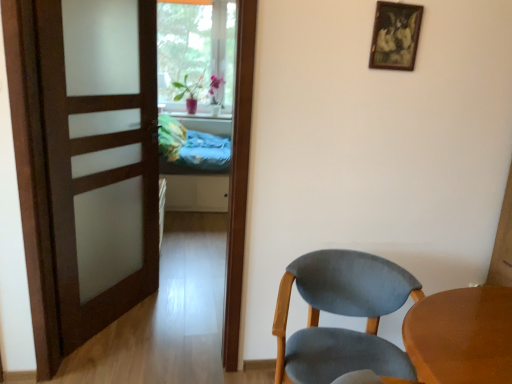
Question: Can you confirm if light blue fabric chair at lower right is thinner than blue fabric bed at center?

Choices:
 (A) no
 (B) yes

Answer: (B)

Question: From the image's perspective, is light blue fabric chair at lower right over blue fabric bed at center?

Choices:
 (A) no
 (B) yes

Answer: (A)

Question: From the image's perspective, is light blue fabric chair at lower right located beneath blue fabric bed at center?

Choices:
 (A) yes
 (B) no

Answer: (A)

Question: From a real-world perspective, is light blue fabric chair at lower right positioned over blue fabric bed at center based on gravity?

Choices:
 (A) yes
 (B) no

Answer: (B)

Question: Can you confirm if light blue fabric chair at lower right is positioned to the right of blue fabric bed at center?

Choices:
 (A) no
 (B) yes

Answer: (B)

Question: Considering their positions, is wooden picture frame at upper right located in front of or behind satin wood door at left?

Choices:
 (A) front
 (B) behind

Answer: (B)

Question: Is wooden picture frame at upper right spatially inside satin wood door at left, or outside of it?

Choices:
 (A) outside
 (B) inside

Answer: (A)

Question: From a real-world perspective, is wooden picture frame at upper right positioned above or below satin wood door at left?

Choices:
 (A) below
 (B) above

Answer: (B)

Question: Considering the positions of wooden picture frame at upper right and satin wood door at left in the image, is wooden picture frame at upper right wider or thinner than satin wood door at left?

Choices:
 (A) wide
 (B) thin

Answer: (B)

Question: From the image's perspective, relative to blue fabric bed at center, is satin wood door at left above or below?

Choices:
 (A) above
 (B) below

Answer: (B)

Question: Which is correct: satin wood door at left is inside blue fabric bed at center, or outside of it?

Choices:
 (A) outside
 (B) inside

Answer: (A)

Question: Is satin wood door at left to the left or to the right of blue fabric bed at center in the image?

Choices:
 (A) right
 (B) left

Answer: (B)

Question: Considering the positions of satin wood door at left and blue fabric bed at center in the image, is satin wood door at left taller or shorter than blue fabric bed at center?

Choices:
 (A) tall
 (B) short

Answer: (A)

Question: In terms of height, does blue fabric bed at center look taller or shorter compared to light blue fabric chair at lower right?

Choices:
 (A) short
 (B) tall

Answer: (B)

Question: From the image's perspective, relative to light blue fabric chair at lower right, is blue fabric bed at center above or below?

Choices:
 (A) above
 (B) below

Answer: (A)